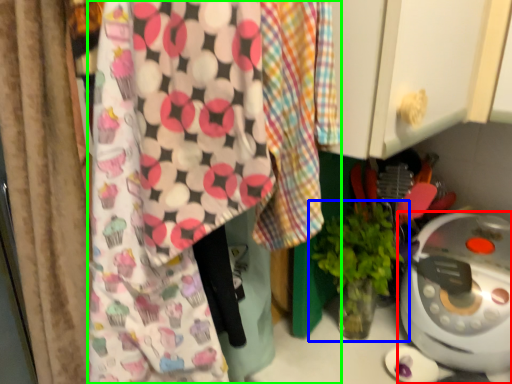
Question: Considering the real-world distances, which object is closest to home appliance (highlighted by a red box)? houseplant (highlighted by a blue box) or wrapping paper (highlighted by a green box).

Choices:
 (A) houseplant
 (B) wrapping paper

Answer: (A)